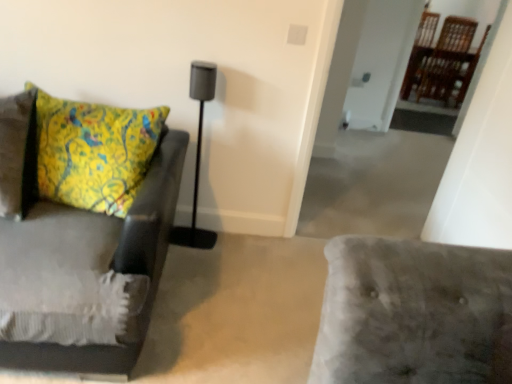
Find the location of a particular element. vacant region below matte black speaker at center (from a real-world perspective) is located at coordinates (190, 238).